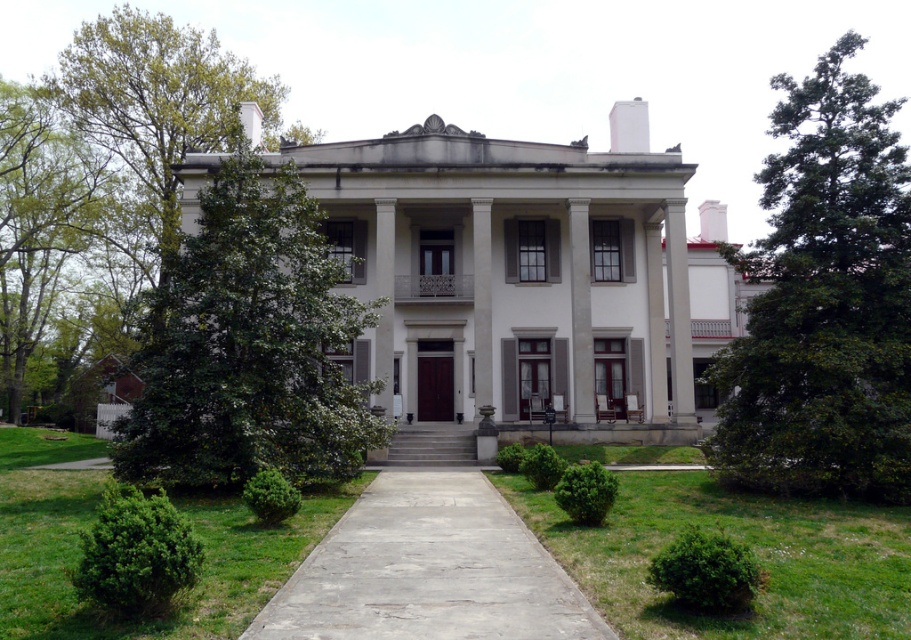
You are standing in front of the grand white building. You see the green leafy tree at right and the green grass at center. Which object is higher in elevation?

The green leafy tree at right is higher in elevation than the green grass at center because it is positioned above it.

You are standing at the entrance of the grand white building and see two points marked on the facade. The first point is at coordinate (903, 381) and the second is at (265, 304). From your current position, which point appears closer to you?

Point (903, 381) is in front of point (265, 304), so it appears closer to you.